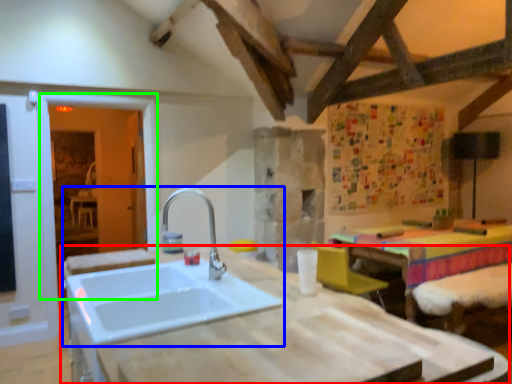
Question: Estimate the real-world distances between objects in this image. Which object is closer to countertop (highlighted by a red box), sink (highlighted by a blue box) or glass door (highlighted by a green box)?

Choices:
 (A) sink
 (B) glass door

Answer: (A)